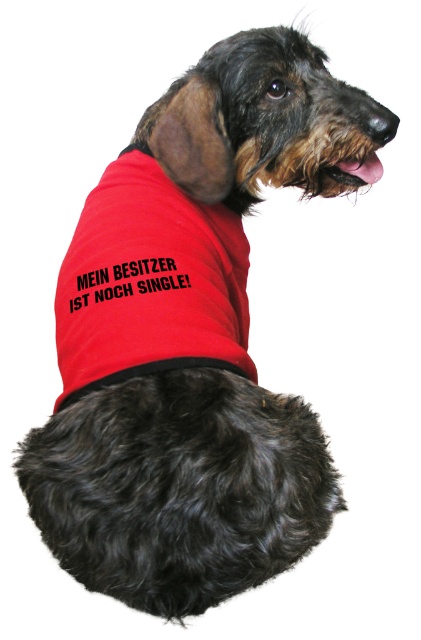
Question: Is black furry head at upper center positioned in front of red fabric t-shirt at center?

Choices:
 (A) no
 (B) yes

Answer: (B)

Question: In this image, where is black furry head at upper center located relative to red fabric t-shirt at center?

Choices:
 (A) above
 (B) below

Answer: (B)

Question: Considering the relative positions of black furry head at upper center and red fabric t-shirt at center in the image provided, where is black furry head at upper center located with respect to red fabric t-shirt at center?

Choices:
 (A) above
 (B) below

Answer: (B)

Question: Which of the following is the farthest from the observer?

Choices:
 (A) red fabric t-shirt at center
 (B) black furry head at upper center

Answer: (A)